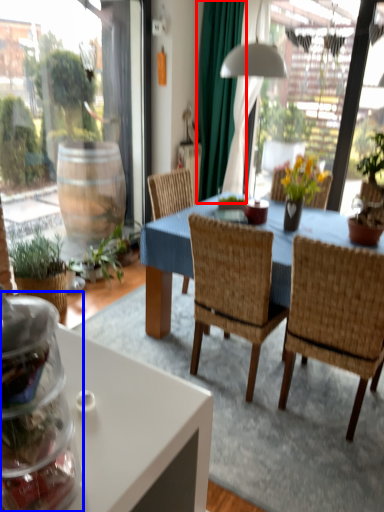
Question: Which object appears farthest to the camera in this image, curtain (highlighted by a red box) or glass jar (highlighted by a blue box)?

Choices:
 (A) curtain
 (B) glass jar

Answer: (A)